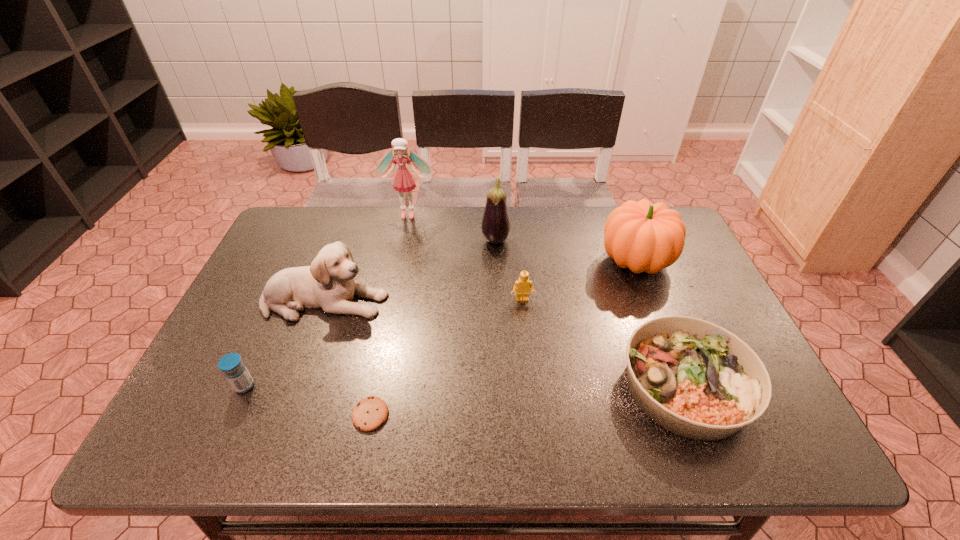
Identify the location of the farthest object. The height and width of the screenshot is (540, 960). (403, 181).

This screenshot has width=960, height=540. In order to click on the tallest object in this screenshot , I will do `click(403, 181)`.

Find the location of a particular element. This screenshot has width=960, height=540. eggplant is located at coordinates (495, 226).

The image size is (960, 540). In order to click on pumpkin in this screenshot , I will do `click(644, 237)`.

Find the location of a particular element. Image resolution: width=960 pixels, height=540 pixels. puppy is located at coordinates (328, 284).

Locate an element on the screen. The image size is (960, 540). Lego is located at coordinates (522, 287).

In order to click on medicine in this screenshot , I will do `click(235, 371)`.

Where is `salad plate`? The height and width of the screenshot is (540, 960). salad plate is located at coordinates (696, 379).

Identify the location of cookie. The image size is (960, 540). (368, 414).

This screenshot has height=540, width=960. I want to click on free space located 0.160m on the front-facing side of the tallest object, so click(400, 251).